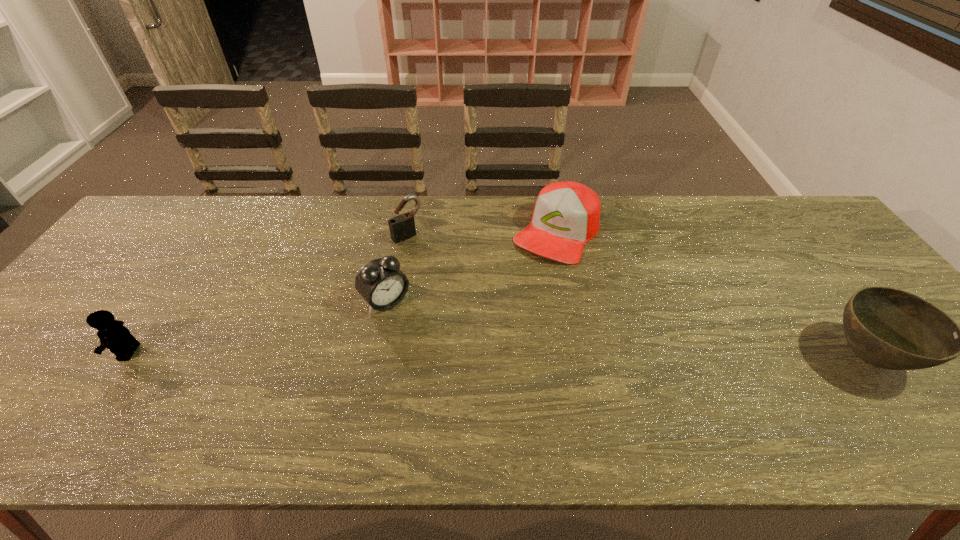
Where is `free space on the desktop that is between the leftmost object and the rightmost object and is positioned with the keyhole on the front of the padlock`? free space on the desktop that is between the leftmost object and the rightmost object and is positioned with the keyhole on the front of the padlock is located at coordinates (516, 355).

At what (x,y) coordinates should I click in order to perform the action: click on free space on the desktop that is between the Lego and the rightmost object and is positioned on the front-facing side of the fourth object from left to right. Please return your answer as a coordinate pair (x, y). Looking at the image, I should click on (468, 355).

I want to click on free space on the desktop that is between the leftmost object and the bowl and is positioned on the front side of the third farthest object, so pos(441,354).